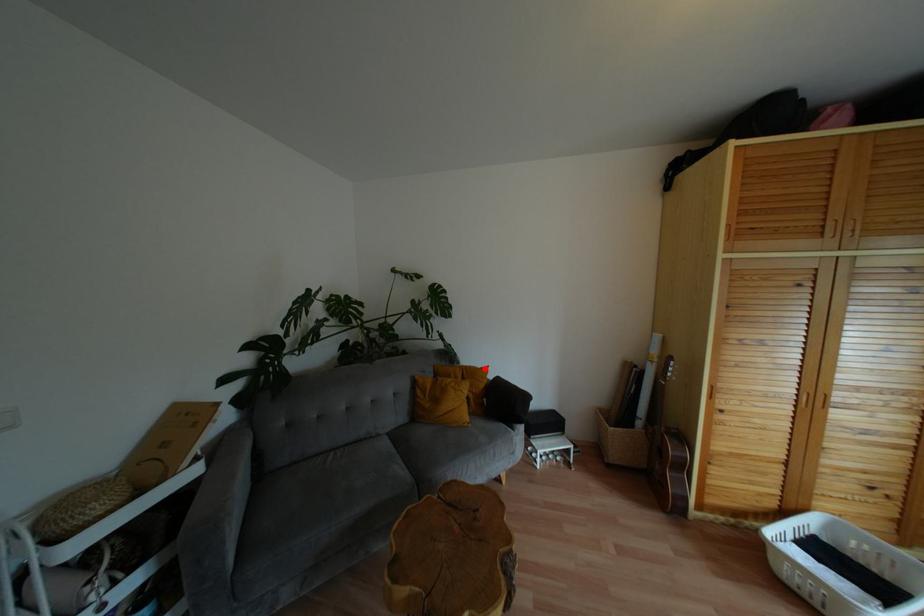
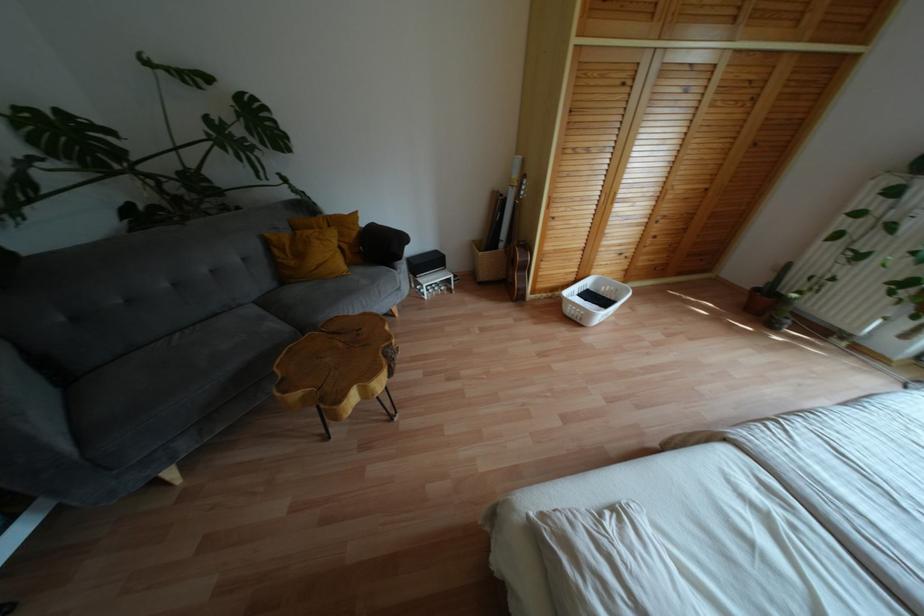
Locate, in the second image, the point that corresponds to the highlighted location in the first image.

(354, 214)